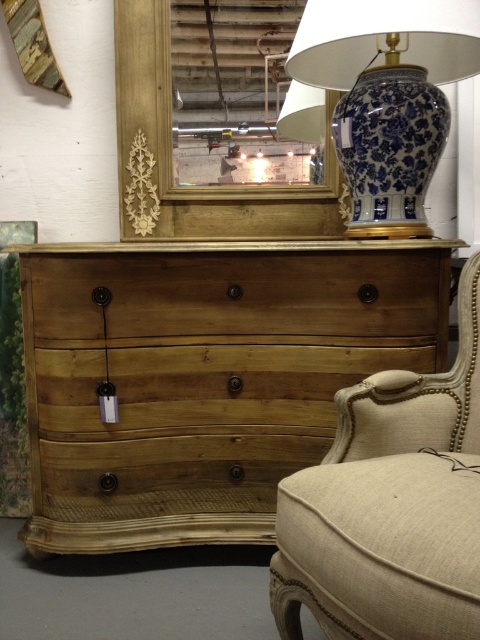
Question: Which point is farther to the camera?

Choices:
 (A) (420, 100)
 (B) (398, 536)
 (C) (404, 236)

Answer: (C)

Question: Does beige fabric swivel chair at right have a larger size compared to natural wood drawer at center?

Choices:
 (A) no
 (B) yes

Answer: (B)

Question: Does natural wood dresser at center have a smaller size compared to beige fabric swivel chair at right?

Choices:
 (A) no
 (B) yes

Answer: (B)

Question: Can you confirm if beige fabric swivel chair at right is positioned to the right of blue porcelain vase at upper right?

Choices:
 (A) yes
 (B) no

Answer: (B)

Question: Which object appears farthest from the camera in this image?

Choices:
 (A) natural wood drawer at center
 (B) beige fabric swivel chair at right

Answer: (A)

Question: Estimate the real-world distances between objects in this image. Which object is farther from the beige fabric swivel chair at right?

Choices:
 (A) blue and white porcelain vase at upper right
 (B) blue porcelain vase at upper right
 (C) natural wood dresser at center
 (D) natural wood drawer at center

Answer: (A)